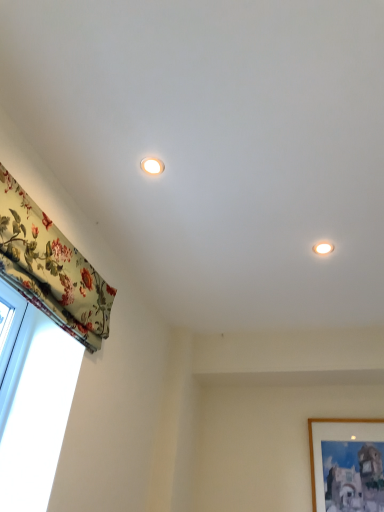
Question: Considering the relative positions of matte white light fixture at upper right, which ranks as the 1th lighting in bottom-to-top order, and matte white light fixture at upper center, the 1th lighting viewed from the front, in the image provided, is matte white light fixture at upper right, which ranks as the 1th lighting in bottom-to-top order, in front of matte white light fixture at upper center, the 1th lighting viewed from the front,?

Choices:
 (A) yes
 (B) no

Answer: (B)

Question: Is matte white light fixture at upper right, the second lighting positioned from the left, located outside matte white light fixture at upper center, marked as the 2th lighting in a back-to-front arrangement?

Choices:
 (A) yes
 (B) no

Answer: (A)

Question: From the image's perspective, would you say matte white light fixture at upper right, the second lighting positioned from the left, is positioned over matte white light fixture at upper center, the 1th lighting viewed from the front?

Choices:
 (A) yes
 (B) no

Answer: (B)

Question: From a real-world perspective, is matte white light fixture at upper right, the 1th lighting in the right-to-left sequence, located higher than matte white light fixture at upper center, which is counted as the 2th lighting, starting from the bottom?

Choices:
 (A) yes
 (B) no

Answer: (B)

Question: From a real-world perspective, is matte white light fixture at upper right, arranged as the 2th lighting when viewed from the top, located beneath matte white light fixture at upper center, the second lighting positioned from the right?

Choices:
 (A) yes
 (B) no

Answer: (A)

Question: Is wooden picture frame at lower right in front of or behind floral fabric curtain at left in the image?

Choices:
 (A) behind
 (B) front

Answer: (A)

Question: In terms of size, does wooden picture frame at lower right appear bigger or smaller than floral fabric curtain at left?

Choices:
 (A) small
 (B) big

Answer: (A)

Question: From the image's perspective, is wooden picture frame at lower right above or below floral fabric curtain at left?

Choices:
 (A) above
 (B) below

Answer: (B)

Question: Is point (375, 480) positioned closer to the camera than point (64, 245)?

Choices:
 (A) farther
 (B) closer

Answer: (A)

Question: Considering the positions of floral fabric curtain at left and matte white light fixture at upper right, placed as the 1th lighting when sorted from back to front, in the image, is floral fabric curtain at left taller or shorter than matte white light fixture at upper right, placed as the 1th lighting when sorted from back to front,?

Choices:
 (A) tall
 (B) short

Answer: (A)

Question: Is point (48, 236) positioned closer to the camera than point (319, 252)?

Choices:
 (A) farther
 (B) closer

Answer: (B)

Question: From the image's perspective, is floral fabric curtain at left above or below matte white light fixture at upper right, the 1th lighting in the right-to-left sequence?

Choices:
 (A) below
 (B) above

Answer: (A)

Question: In terms of width, does floral fabric curtain at left look wider or thinner when compared to matte white light fixture at upper right, the second lighting positioned from the left?

Choices:
 (A) thin
 (B) wide

Answer: (A)

Question: Is matte white light fixture at upper center, which is counted as the 2th lighting, starting from the bottom, wider or thinner than wooden picture frame at lower right?

Choices:
 (A) thin
 (B) wide

Answer: (B)

Question: Would you say matte white light fixture at upper center, the first lighting when ordered from left to right, is to the left or to the right of wooden picture frame at lower right in the picture?

Choices:
 (A) left
 (B) right

Answer: (A)